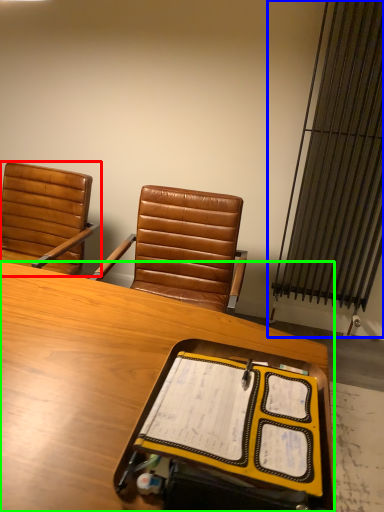
Question: Which object is positioned farthest from chair (highlighted by a red box)? Select from radiator (highlighted by a blue box) and desk (highlighted by a green box).

Choices:
 (A) radiator
 (B) desk

Answer: (A)